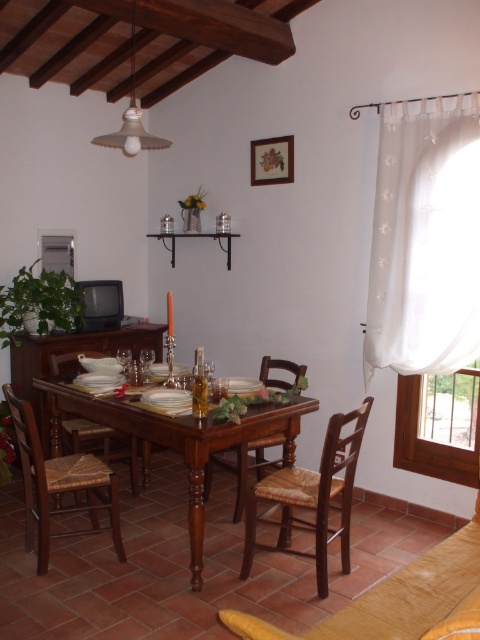
Question: Is white sheer curtain at right below brown woven chair at center?

Choices:
 (A) no
 (B) yes

Answer: (A)

Question: Observing the image, what is the correct spatial positioning of white sheer curtain at right in reference to woven wood chair at center?

Choices:
 (A) below
 (B) above

Answer: (B)

Question: Which object is farther from the camera taking this photo?

Choices:
 (A) woven wood chair at lower left
 (B) white sheer curtain at right
 (C) woven wood chair at center
 (D) brown woven chair at center

Answer: (C)

Question: Which object appears closest to the camera in this image?

Choices:
 (A) mahogany wood table at center
 (B) woven wood chair at lower left

Answer: (A)

Question: Is woven wood chair at center bigger than woven brown chair at center?

Choices:
 (A) no
 (B) yes

Answer: (B)

Question: Estimate the real-world distances between objects in this image. Which object is farther from the woven wood chair at lower left?

Choices:
 (A) woven brown chair at center
 (B) white sheer curtain at right

Answer: (B)